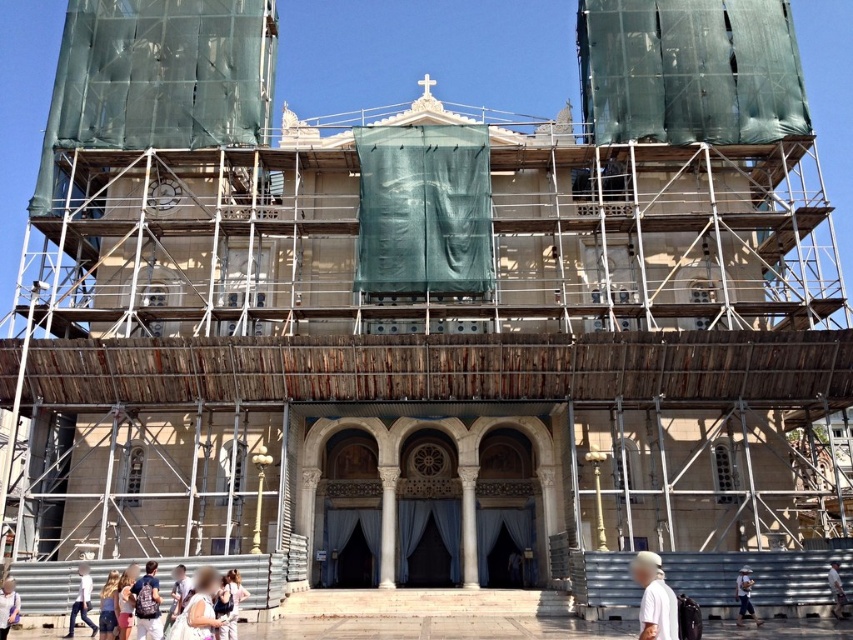
Question: Estimate the real-world distances between objects in this image. Which object is farther from the dark blue backpack at center?

Choices:
 (A) white cotton dress at center
 (B) white cotton shirt at center
 (C) light beige backpack at lower left

Answer: (B)

Question: Can you confirm if white matte shirt at lower right is wider than white cotton shirt at lower left?

Choices:
 (A) no
 (B) yes

Answer: (B)

Question: Which point is closer to the camera?

Choices:
 (A) (198, 628)
 (B) (78, 568)
 (C) (132, 588)
 (D) (9, 600)

Answer: (A)

Question: In this image, where is white matte shirt at lower right located relative to white cotton shirt at lower left?

Choices:
 (A) above
 (B) below

Answer: (A)

Question: Which point is farther to the camera?

Choices:
 (A) white cotton shirt at lower left
 (B) light beige backpack at lower left
 (C) dark blue backpack at center
 (D) white cotton shirt at center

Answer: (D)

Question: Is light beige backpack at lower left closer to camera compared to white cotton shirt at lower right?

Choices:
 (A) yes
 (B) no

Answer: (A)